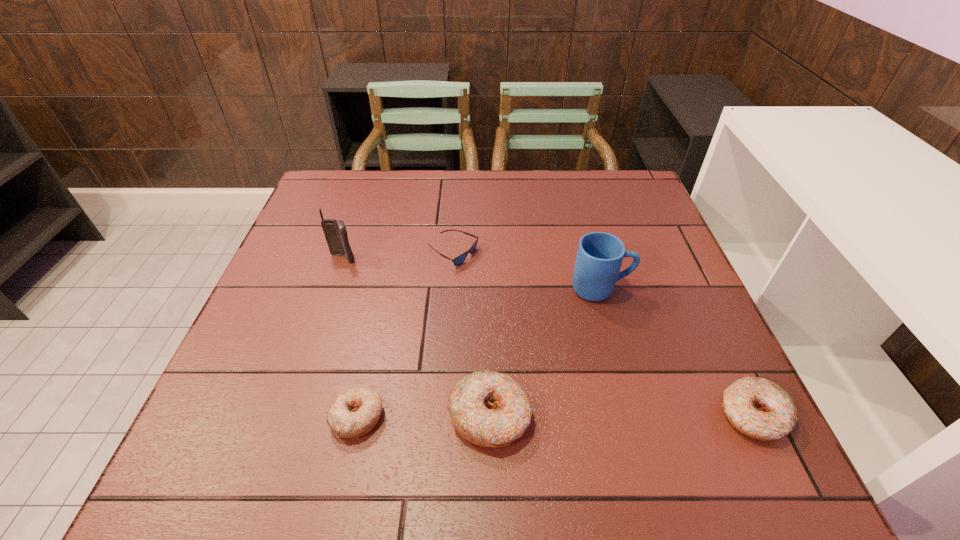
Identify the location of free space located on the right of the second object from left to right. Image resolution: width=960 pixels, height=540 pixels. (511, 417).

You are a GUI agent. You are given a task and a screenshot of the screen. Output one action in this format:
    pyautogui.click(x=<x>, y=<y>)
    Task: Click on the free space located on the right of the second doughnut from right to left
    The height and width of the screenshot is (540, 960).
    Given the screenshot: What is the action you would take?
    pyautogui.click(x=646, y=416)

Image resolution: width=960 pixels, height=540 pixels. I want to click on blank space located 0.360m on the back of the third shortest object, so click(x=679, y=261).

Locate an element on the screen. This screenshot has width=960, height=540. free space located 0.050m on the keyboard of the leftmost object is located at coordinates (336, 279).

Find the location of a particular element. The image size is (960, 540). free space located at the front of the shortest object showing the lenses is located at coordinates (616, 253).

Where is `blank area located on the side of the fifth object from left to right with the handle`? This screenshot has height=540, width=960. blank area located on the side of the fifth object from left to right with the handle is located at coordinates (652, 289).

You are a GUI agent. You are given a task and a screenshot of the screen. Output one action in this format:
    pyautogui.click(x=<x>, y=<y>)
    Task: Click on the object at the left edge
    
    Given the screenshot: What is the action you would take?
    pyautogui.click(x=335, y=232)

Where is `doughnut that is at the right edge`? This screenshot has height=540, width=960. doughnut that is at the right edge is located at coordinates (759, 408).

What are the coordinates of `mug present at the right edge` in the screenshot? It's located at (599, 257).

You are a GUI agent. You are given a task and a screenshot of the screen. Output one action in this format:
    pyautogui.click(x=<x>, y=<y>)
    Task: Click on the object present at the near right corner
    This screenshot has height=540, width=960.
    Given the screenshot: What is the action you would take?
    pyautogui.click(x=759, y=408)